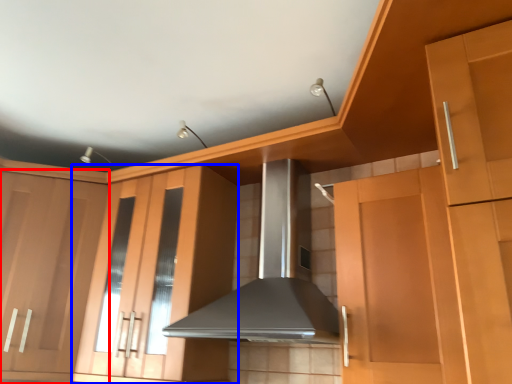
Question: Which object appears farthest to the camera in this image, cabinetry (highlighted by a red box) or cabinetry (highlighted by a blue box)?

Choices:
 (A) cabinetry
 (B) cabinetry

Answer: (A)